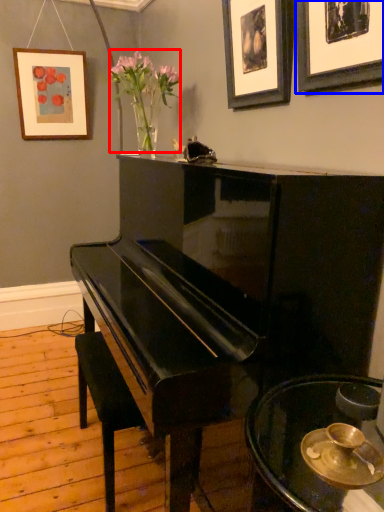
Question: Which point is closer to the camera, floral arrangement (highlighted by a red box) or picture frame (highlighted by a blue box)?

Choices:
 (A) floral arrangement
 (B) picture frame

Answer: (B)